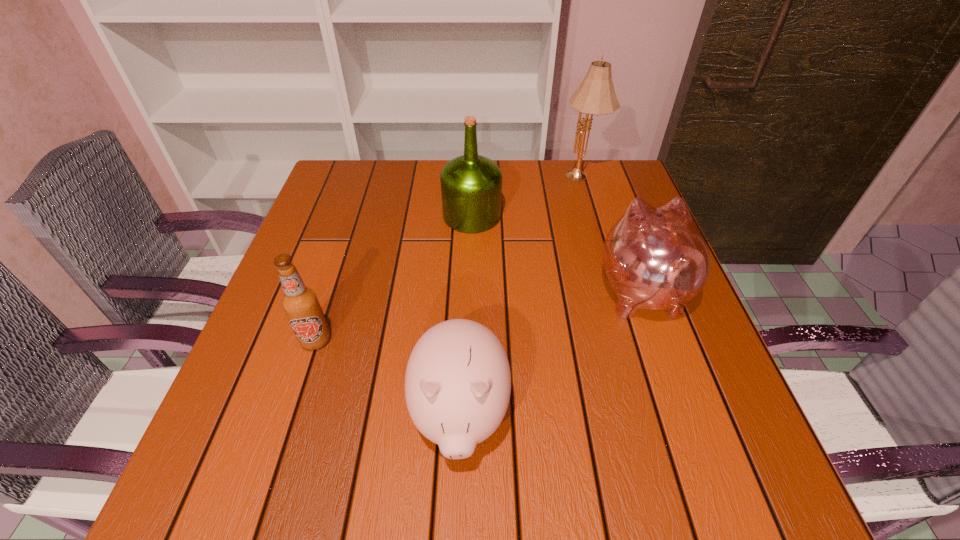
Identify the location of object at the far right corner. (596, 95).

Find the location of a particular element. vacant space at the far edge of the desktop is located at coordinates (562, 165).

Image resolution: width=960 pixels, height=540 pixels. In order to click on free space at the near edge in this screenshot , I will do `click(386, 503)`.

The image size is (960, 540). I want to click on vacant area at the left edge, so click(x=293, y=342).

What are the coordinates of `vacant space at the right edge of the desktop` in the screenshot? It's located at (609, 218).

Where is `vacant space at the far right corner of the desktop`? vacant space at the far right corner of the desktop is located at coordinates (630, 189).

In the image, there is a desktop. Identify the location of free space at the near right corner. This screenshot has width=960, height=540. (690, 482).

Locate an element on the screen. The image size is (960, 540). vacant region between the nearer piggy bank and the lampshade is located at coordinates (520, 296).

I want to click on empty space that is in between the fourth nearest object and the farther piggy bank, so click(557, 253).

At what (x,y) coordinates should I click in order to perform the action: click on empty space that is in between the fourth nearest object and the left piggy bank. Please return your answer as a coordinate pair (x, y). Looking at the image, I should click on (466, 315).